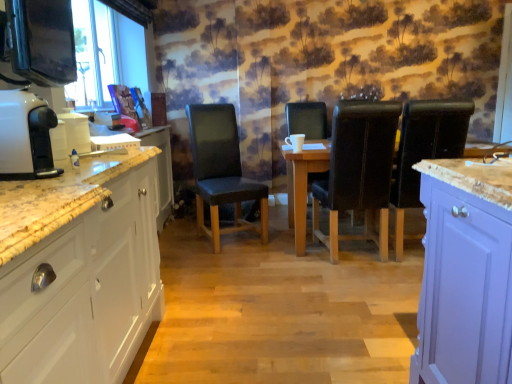
What do you see at coordinates (425, 150) in the screenshot? Image resolution: width=512 pixels, height=384 pixels. I see `black leather chair at right, placed as the 4th chair when sorted from left to right` at bounding box center [425, 150].

Where is `black leather chair at center, which appears as the 3th chair when viewed from the right`? The image size is (512, 384). black leather chair at center, which appears as the 3th chair when viewed from the right is located at coordinates (307, 119).

Describe the element at coordinates (302, 182) in the screenshot. I see `wooden table at center` at that location.

Locate an element on the screen. white glossy cabinet at left is located at coordinates (79, 271).

The width and height of the screenshot is (512, 384). Find the location of `leather-like black chair at center-left, the first chair from the left`. leather-like black chair at center-left, the first chair from the left is located at coordinates point(221,171).

Could you measure the distance between black leather chair at right, the first chair in the right-to-left sequence, and wooden table at center?

They are 25.45 inches apart.

Considering the relative sizes of black leather chair at right, placed as the 4th chair when sorted from left to right, and wooden table at center in the image provided, is black leather chair at right, placed as the 4th chair when sorted from left to right, smaller than wooden table at center?

Indeed, black leather chair at right, placed as the 4th chair when sorted from left to right, has a smaller size compared to wooden table at center.

How different are the orientations of black leather chair at right, placed as the 4th chair when sorted from left to right, and wooden table at center in degrees?

The angle between the facing direction of black leather chair at right, placed as the 4th chair when sorted from left to right, and the facing direction of wooden table at center is 180 degrees.

Is there a large distance between black leather chair at right, the first chair in the right-to-left sequence, and wooden table at center?

No, black leather chair at right, the first chair in the right-to-left sequence, is not far from wooden table at center.

Considering the relative sizes of leather-like black chair at center-left, the first chair from the left, and white glossy cabinet at left in the image provided, is leather-like black chair at center-left, the first chair from the left, smaller than white glossy cabinet at left?

Indeed, leather-like black chair at center-left, the first chair from the left, has a smaller size compared to white glossy cabinet at left.

Is leather-like black chair at center-left, the first chair from the left, shorter than white glossy cabinet at left?

In fact, leather-like black chair at center-left, the first chair from the left, may be taller than white glossy cabinet at left.

Between leather-like black chair at center-left, which appears as the fourth chair when viewed from the right, and white glossy cabinet at left, which one appears on the right side from the viewer's perspective?

leather-like black chair at center-left, which appears as the fourth chair when viewed from the right.

Can you tell me how much leather-like black chair at center-left, the first chair from the left, and white glossy cabinet at left differ in facing direction?

There is a 64.2-degree angle between the facing directions of leather-like black chair at center-left, the first chair from the left, and white glossy cabinet at left.

Does wooden table at center appear on the right side of leather at center, which is counted as the second chair, starting from the right?

Yes, wooden table at center is to the right of leather at center, which is counted as the second chair, starting from the right.

Does wooden table at center come behind leather at center, which is the 3th chair from left to right?

Yes, wooden table at center is further from the camera.

Is wooden table at center taller or shorter than leather at center, which is the 3th chair from left to right?

wooden table at center is shorter than leather at center, which is the 3th chair from left to right.

How different are the orientations of wooden table at center and leather at center, which is counted as the second chair, starting from the right, in degrees?

The facing directions of wooden table at center and leather at center, which is counted as the second chair, starting from the right, are 175 degrees apart.

Is white glossy cabinet at left oriented away from white glossy coffee machine at left?

No, white glossy cabinet at left is not facing the opposite direction of white glossy coffee machine at left.

What's the angular difference between white glossy cabinet at left and white glossy coffee machine at left's facing directions?

The angle between the facing direction of white glossy cabinet at left and the facing direction of white glossy coffee machine at left is 2.02 degrees.

Does white glossy cabinet at left have a greater height compared to white glossy coffee machine at left?

Indeed, white glossy cabinet at left has a greater height compared to white glossy coffee machine at left.

Is white glossy cabinet at left situated inside white glossy coffee machine at left or outside?

white glossy cabinet at left is not inside white glossy coffee machine at left, it's outside.

From a real-world perspective, is leather at center, which is the 3th chair from left to right, over wooden table at center?

Indeed, from a real-world perspective, leather at center, which is the 3th chair from left to right, stands above wooden table at center.

Does point (336, 186) lie behind point (311, 148)?

No, it is in front of (311, 148).

Is leather at center, which is the 3th chair from left to right, touching wooden table at center?

No, leather at center, which is the 3th chair from left to right, is not touching wooden table at center.

Between white glossy cabinet at left and leather-like black chair at center-left, the first chair from the left, which one has more height?

Standing taller between the two is leather-like black chair at center-left, the first chair from the left.

Would you say white glossy cabinet at left is outside leather-like black chair at center-left, the first chair from the left?

Absolutely, white glossy cabinet at left is external to leather-like black chair at center-left, the first chair from the left.

Could you measure the distance between white glossy cabinet at left and leather-like black chair at center-left, which appears as the fourth chair when viewed from the right?

white glossy cabinet at left and leather-like black chair at center-left, which appears as the fourth chair when viewed from the right, are 5.17 feet apart from each other.

From the image's perspective, which one is positioned lower, white glossy cabinet at left or leather-like black chair at center-left, which appears as the fourth chair when viewed from the right?

white glossy cabinet at left, from the image's perspective.

Who is taller, leather-like black chair at center-left, the first chair from the left, or wooden table at center?

leather-like black chair at center-left, the first chair from the left.

Is point (237, 176) closer to camera compared to point (292, 195)?

No.

Does leather-like black chair at center-left, the first chair from the left, have a lesser width compared to wooden table at center?

Correct, the width of leather-like black chair at center-left, the first chair from the left, is less than that of wooden table at center.

Would you consider leather-like black chair at center-left, which appears as the fourth chair when viewed from the right, to be distant from wooden table at center?

That's not correct — leather-like black chair at center-left, which appears as the fourth chair when viewed from the right, is a little close to wooden table at center.

This screenshot has height=384, width=512. Find the location of `the 2nd chair positioned above the wooden table at center (from a real-world perspective)`. the 2nd chair positioned above the wooden table at center (from a real-world perspective) is located at coordinates (425, 150).

Locate an element on the screen. The width and height of the screenshot is (512, 384). chair that is the 3rd one when counting upward from the white glossy cabinet at left (from the image's perspective) is located at coordinates (221, 171).

Based on their spatial positions, is leather at center, which is the 3th chair from left to right, or black leather chair at center, the 2th chair from the left, further from wooden table at center?

Among the two, black leather chair at center, the 2th chair from the left, is located further to wooden table at center.

When comparing their distances from black leather chair at center, which appears as the 3th chair when viewed from the right, does leather at center, which is the 3th chair from left to right, or wooden table at center seem closer?

wooden table at center is closer to black leather chair at center, which appears as the 3th chair when viewed from the right.

From the image, which object appears to be farther from wooden table at center, white glossy coffee machine at left or black leather chair at right, placed as the 4th chair when sorted from left to right?

Among the two, white glossy coffee machine at left is located further to wooden table at center.

Estimate the real-world distances between objects in this image. Which object is closer to wooden table at center, black leather chair at center, which appears as the 3th chair when viewed from the right, or leather-like black chair at center-left, which appears as the fourth chair when viewed from the right?

The object closer to wooden table at center is leather-like black chair at center-left, which appears as the fourth chair when viewed from the right.

Estimate the real-world distances between objects in this image. Which object is further from black leather chair at center, the 2th chair from the left, leather-like black chair at center-left, the first chair from the left, or white glossy cabinet at left?

white glossy cabinet at left is positioned further to the anchor black leather chair at center, the 2th chair from the left.

Which object lies nearer to the anchor point black leather chair at right, placed as the 4th chair when sorted from left to right, leather at center, which is the 3th chair from left to right, or white glossy coffee machine at left?

Based on the image, leather at center, which is the 3th chair from left to right, appears to be nearer to black leather chair at right, placed as the 4th chair when sorted from left to right.

When comparing their distances from black leather chair at right, the first chair in the right-to-left sequence, does white glossy coffee machine at left or white glossy cabinet at left seem closer?

The object closer to black leather chair at right, the first chair in the right-to-left sequence, is white glossy cabinet at left.

Estimate the real-world distances between objects in this image. Which object is further from black leather chair at right, the first chair in the right-to-left sequence, white glossy cabinet at left or black leather chair at center, the 2th chair from the left?

Among the two, white glossy cabinet at left is located further to black leather chair at right, the first chair in the right-to-left sequence.

I want to click on cabinetry between white glossy coffee machine at left and black leather chair at right, the first chair in the right-to-left sequence, from left to right, so click(79, 271).

You are a GUI agent. You are given a task and a screenshot of the screen. Output one action in this format:
    pyautogui.click(x=<x>, y=<y>)
    Task: Click on the appliance located between white glossy cabinet at left and black leather chair at center, the 2th chair from the left, in the depth direction
    The height and width of the screenshot is (384, 512).
    Given the screenshot: What is the action you would take?
    pyautogui.click(x=26, y=136)

Where is `appliance positioned between white glossy cabinet at left and leather at center, which is counted as the second chair, starting from the right, from near to far`? The image size is (512, 384). appliance positioned between white glossy cabinet at left and leather at center, which is counted as the second chair, starting from the right, from near to far is located at coordinates (26, 136).

Where is `kitchen & dining room table between white glossy cabinet at left and black leather chair at right, placed as the 4th chair when sorted from left to right`? kitchen & dining room table between white glossy cabinet at left and black leather chair at right, placed as the 4th chair when sorted from left to right is located at coordinates (302, 182).